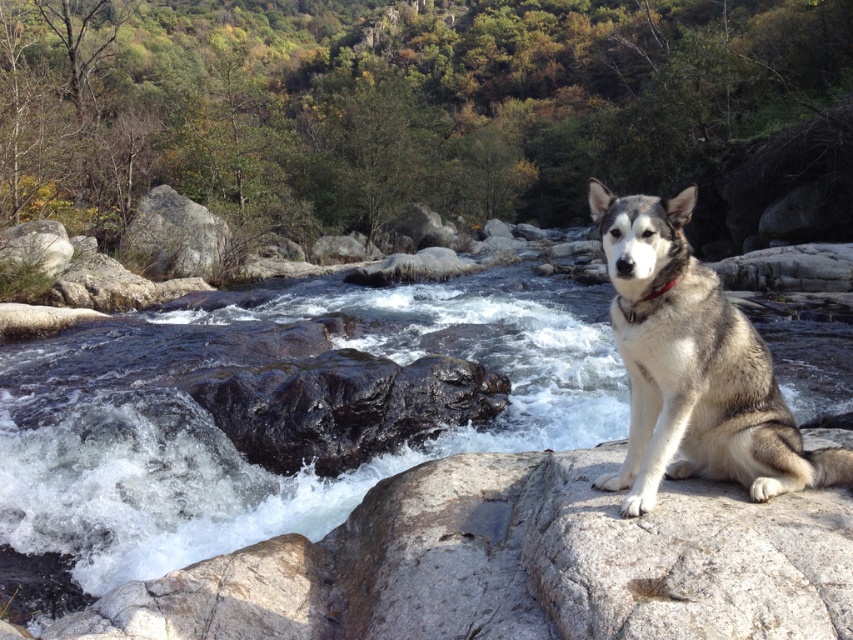
Is point (132, 474) positioned before point (788, 413)?

No, it is not.

Who is positioned more to the left, clear water at stream right or gray fur dog at right?

clear water at stream right is more to the left.

The width and height of the screenshot is (853, 640). What do you see at coordinates (236, 444) in the screenshot?
I see `clear water at stream right` at bounding box center [236, 444].

Image resolution: width=853 pixels, height=640 pixels. Find the location of `clear water at stream right`. clear water at stream right is located at coordinates (236, 444).